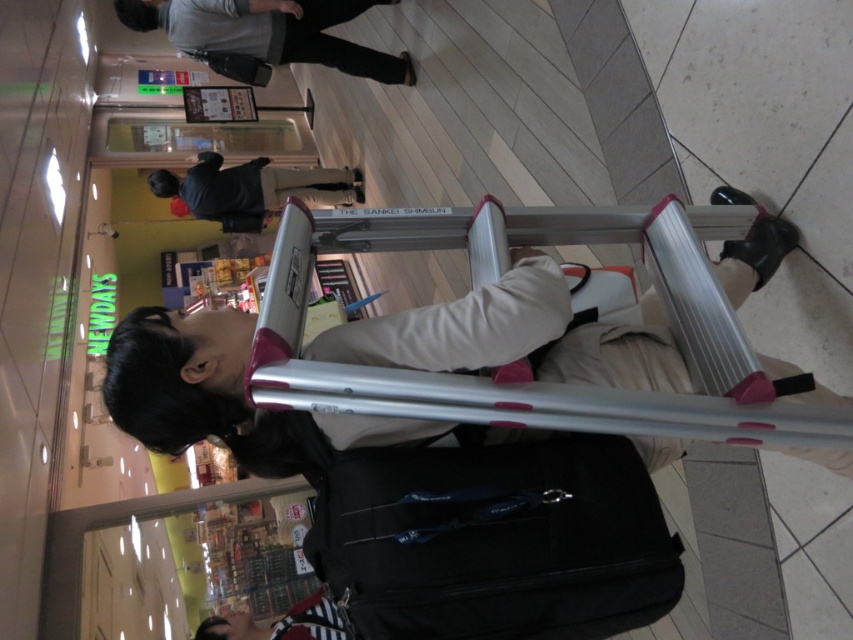
You are a photographer trying to capture both the gray fabric jacket at upper center and the black matte jacket at upper center in a single shot. Which jacket will appear closer to the camera in the photo?

The gray fabric jacket at upper center is positioned over the black matte jacket at upper center, so it will appear closer to the camera in the photo.

You are a photographer trying to capture a clear shot of both the gray fabric jacket at upper center and the black matte jacket at upper center. Since you want both jackets to be in the frame, which jacket should you position your camera closer to?

To capture both the gray fabric jacket at upper center and the black matte jacket at upper center in the frame, position your camera closer to the black matte jacket at upper center. This is because the gray fabric jacket at upper center is on the right side of the black matte jacket at upper center, so centering the camera between them would ensure both are visible.

You are a person who needs to use the silver metallic crutches at center. Where exactly are they located in the image?

The silver metallic crutches at center are located at point (515, 336) in the image.